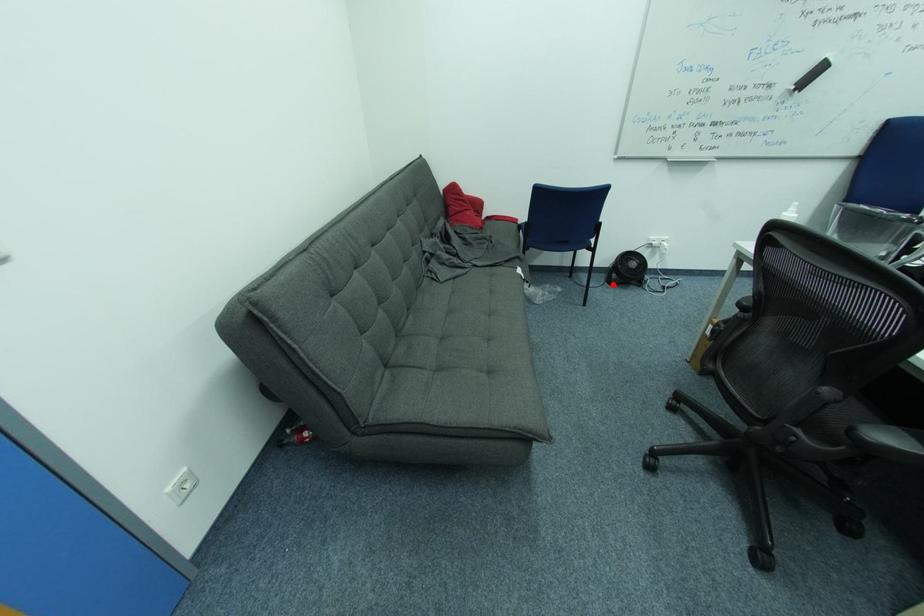
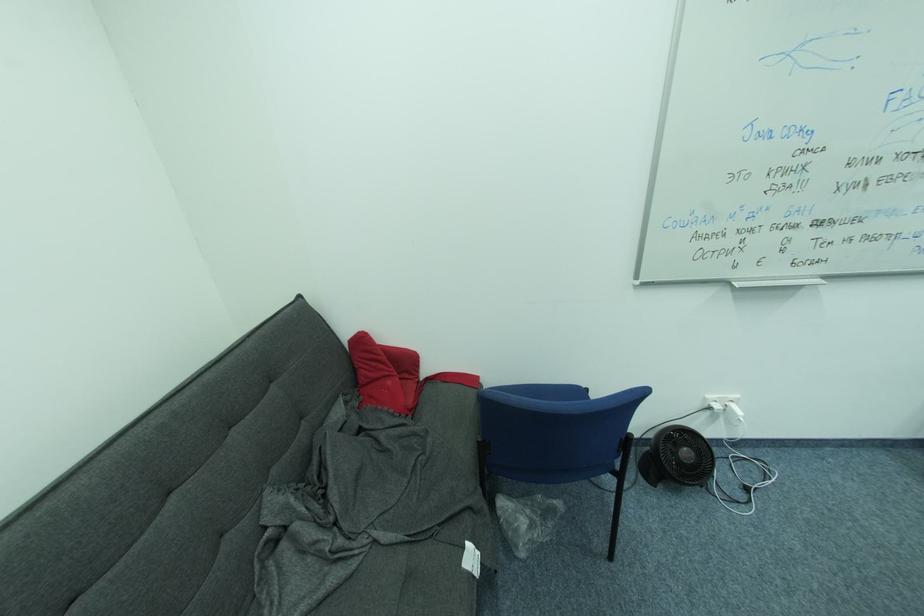
Question: I am providing you with two images of the same scene from different viewpoints. In image1, a red point is highlighted. Considering the same 3D point in image2, which of the following is correct?

Choices:
 (A) It is closer
 (B) It is farther

Answer: (A)